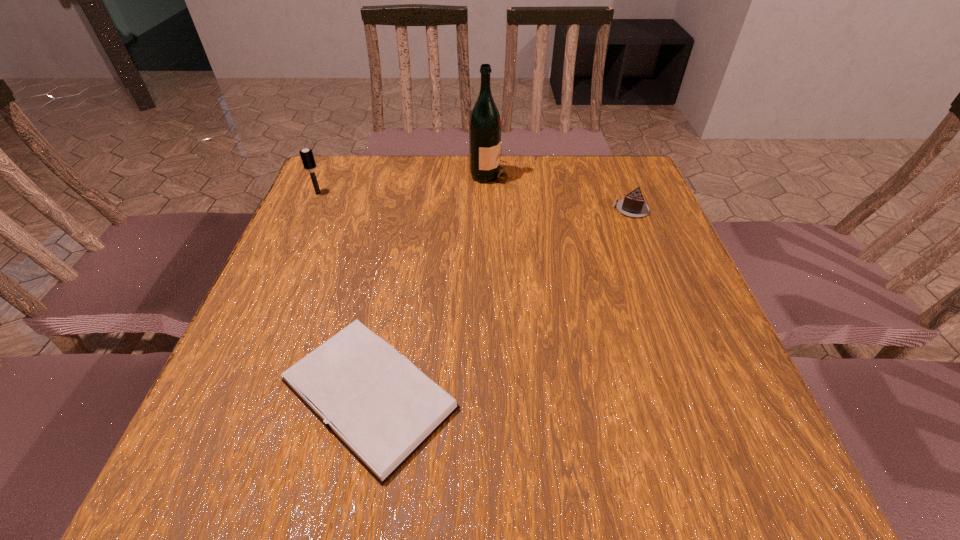
Find the location of a particular element. This screenshot has height=540, width=960. free spot between the wine bottle and the hairbrush is located at coordinates (403, 184).

Locate an element on the screen. The image size is (960, 540). vacant space that's between the second farthest object and the shortest object is located at coordinates (344, 293).

What are the coordinates of `vacant space that is in between the tallest object and the leftmost object` in the screenshot? It's located at (403, 184).

Image resolution: width=960 pixels, height=540 pixels. What are the coordinates of `free space between the third tallest object and the shortest object` in the screenshot? It's located at (499, 301).

Locate an element on the screen. free space between the second nearest object and the hardback book is located at coordinates (499, 301).

Where is `vacant region between the hairbrush and the shortest object`? vacant region between the hairbrush and the shortest object is located at coordinates (344, 293).

You are a GUI agent. You are given a task and a screenshot of the screen. Output one action in this format:
    pyautogui.click(x=<x>, y=<y>)
    Task: Click on the vacant space in between the hairbrush and the second object from right to left
    The image size is (960, 540).
    Given the screenshot: What is the action you would take?
    pyautogui.click(x=403, y=184)

The height and width of the screenshot is (540, 960). I want to click on blank region between the chocolate cake and the nearest object, so click(499, 301).

Select which object is the third closest to the chocolate cake. Please provide its 2D coordinates. Your answer should be formatted as a tuple, i.e. [(x, y)], where the tuple contains the x and y coordinates of a point satisfying the conditions above.

[(307, 157)]

Select which object is the second closest to the second object from left to right. Please provide its 2D coordinates. Your answer should be formatted as a tuple, i.e. [(x, y)], where the tuple contains the x and y coordinates of a point satisfying the conditions above.

[(485, 124)]